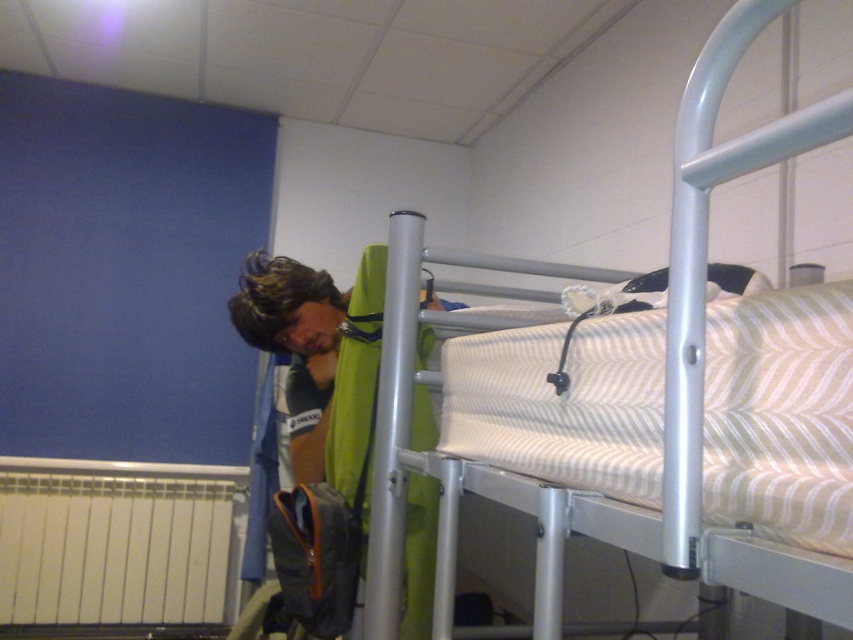
You are standing in the hostel room and want to place a small plant between the two points, point (422,221) and point (421,508). Which point should the plant be closer to in order to be nearer to the viewer?

The plant should be closer to point (422,221) because it is nearer to the viewer than point (421,508).

You are standing at the center of the room and want to place a new poster on the wall near the metallic silver bunk bed at upper right. According to the coordinates provided, where should you aim to place the poster?

The metallic silver bunk bed at upper right is located at coordinates point [664,388], so you should aim near that point to place the poster.

In the scene shown: You are a guest staying in the hostel and want to place your backpack on the floor. The backpack is 1 meter long. Is there enough space between the metallic silver bunk bed at upper right and the green fabric at center to place it without touching either?

The metallic silver bunk bed at upper right is positioned over the green fabric at center, so placing a 1 meter long backpack between them may not be possible as the distance between them is likely less than 1 meter. Check the actual space before placing it.